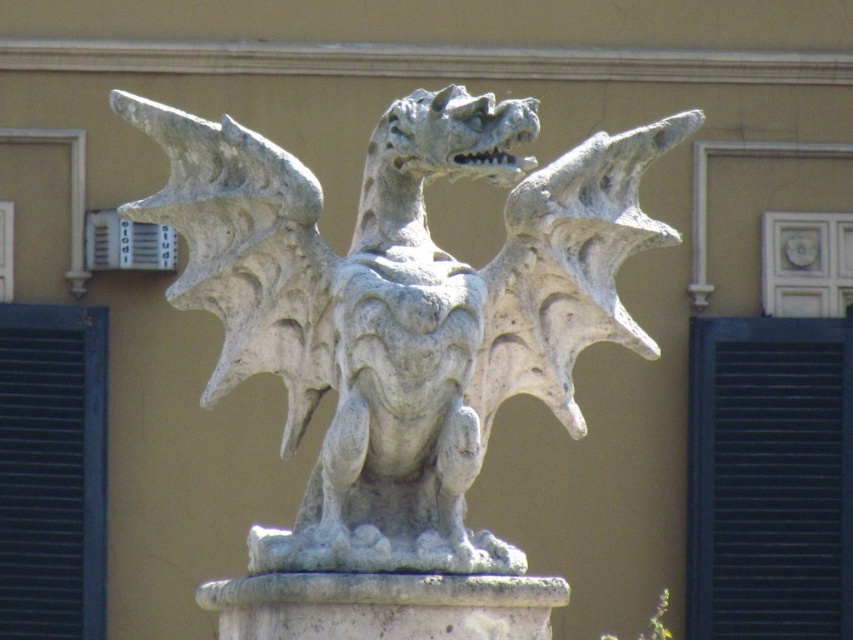
Question: Estimate the real-world distances between objects in this image. Which object is farther from the black matte shutter at right?

Choices:
 (A) blue painted wood shutter at left
 (B) gray stone dragon at center

Answer: (B)

Question: Is gray stone dragon at center closer to camera compared to blue painted wood shutter at left?

Choices:
 (A) yes
 (B) no

Answer: (A)

Question: Is gray stone dragon at center positioned before black matte shutter at right?

Choices:
 (A) no
 (B) yes

Answer: (B)

Question: Is gray stone dragon at center below black matte shutter at right?

Choices:
 (A) no
 (B) yes

Answer: (A)

Question: Among these points, which one is nearest to the camera?

Choices:
 (A) (103, 515)
 (B) (415, 429)

Answer: (B)

Question: Which point is closer to the camera?

Choices:
 (A) (88, 518)
 (B) (469, 106)
 (C) (779, 355)

Answer: (B)